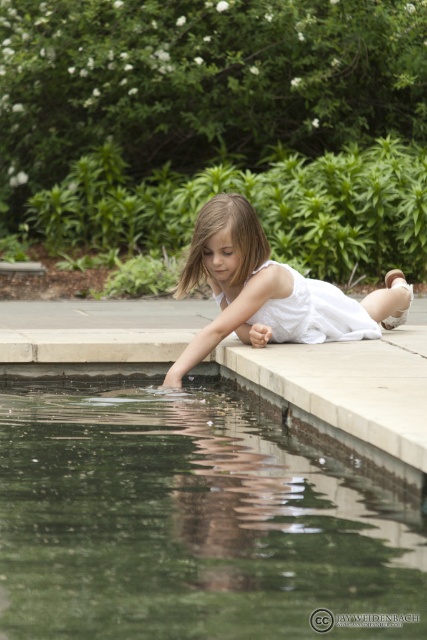
Question: Which is nearer to the white lace dress at center?

Choices:
 (A) green reflective water at lower center
 (B) white cotton dress at center

Answer: (B)

Question: Is white cotton dress at center positioned in front of white lace dress at center?

Choices:
 (A) yes
 (B) no

Answer: (A)

Question: Which of the following is the farthest from the observer?

Choices:
 (A) white cotton dress at center
 (B) green reflective water at lower center
 (C) white lace dress at center

Answer: (C)

Question: Considering the real-world distances, which object is farthest from the white cotton dress at center?

Choices:
 (A) green reflective water at lower center
 (B) white lace dress at center

Answer: (A)

Question: Is white cotton dress at center thinner than white lace dress at center?

Choices:
 (A) no
 (B) yes

Answer: (A)

Question: Can you confirm if green reflective water at lower center is wider than white cotton dress at center?

Choices:
 (A) no
 (B) yes

Answer: (B)